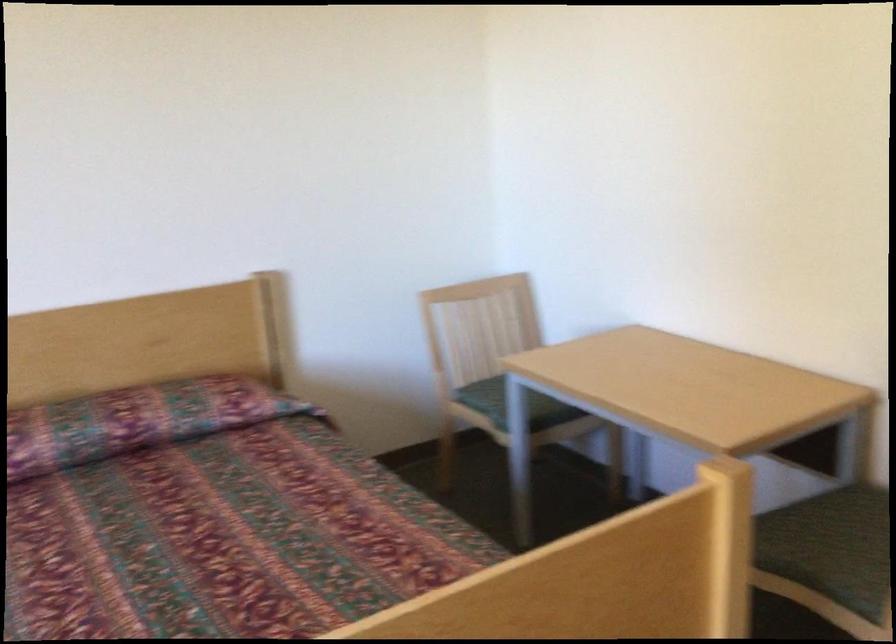
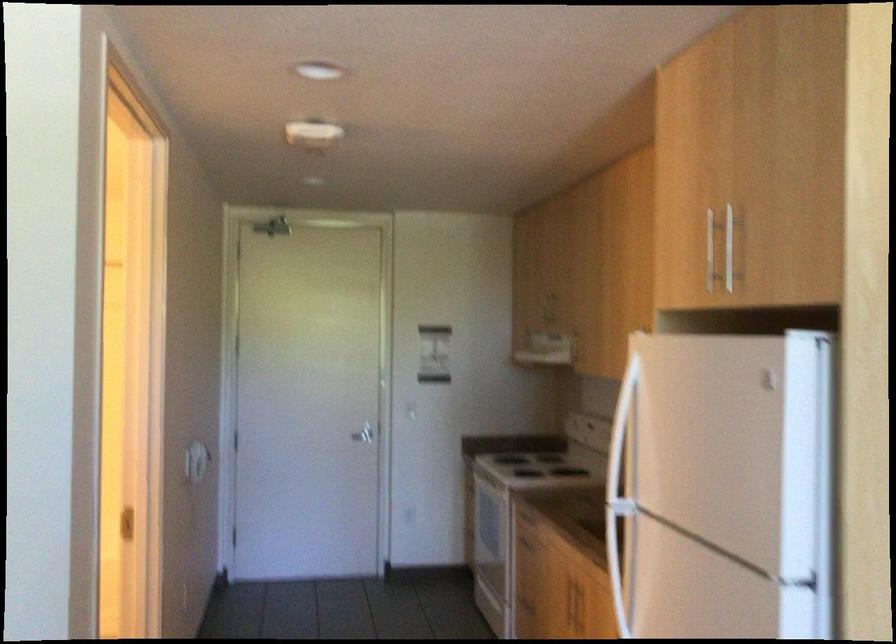
Question: The camera is either moving clockwise (left) or counter-clockwise (right) around the object. The first image is from the beginning of the video and the second image is from the end. Is the camera moving left or right when shooting the video?

Choices:
 (A) Left
 (B) Right

Answer: (A)